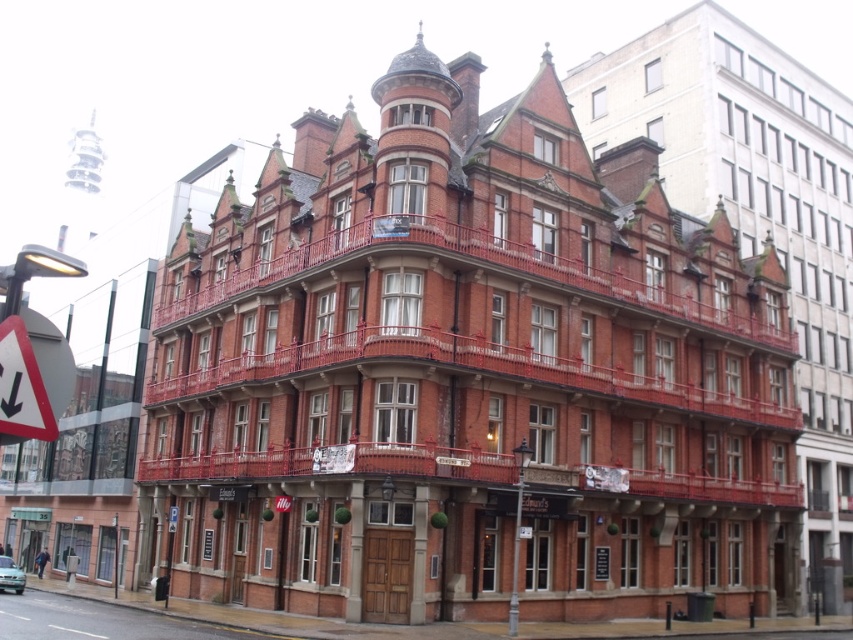
Question: Can you confirm if brick building at center is positioned above metallic reflective triangle at left?

Choices:
 (A) yes
 (B) no

Answer: (A)

Question: Which point is farther to the camera?

Choices:
 (A) (837, 369)
 (B) (48, 401)

Answer: (A)

Question: Is brick building at center to the left of metallic reflective triangle at left from the viewer's perspective?

Choices:
 (A) no
 (B) yes

Answer: (A)

Question: Does brick building at center have a smaller size compared to metallic reflective triangle at left?

Choices:
 (A) no
 (B) yes

Answer: (A)